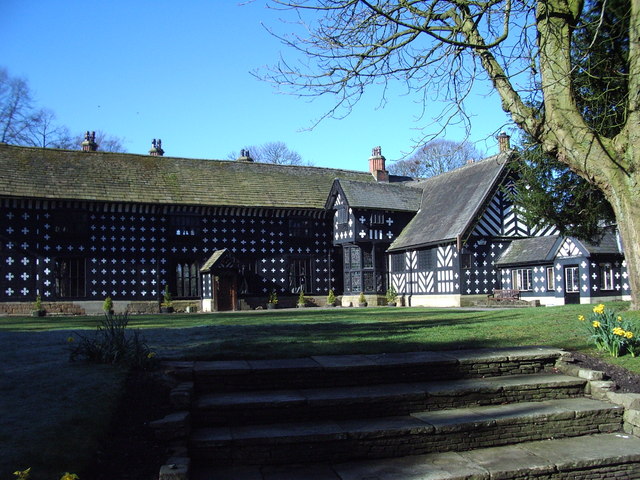
Find the location of `entrance way`. entrance way is located at coordinates (227, 273).